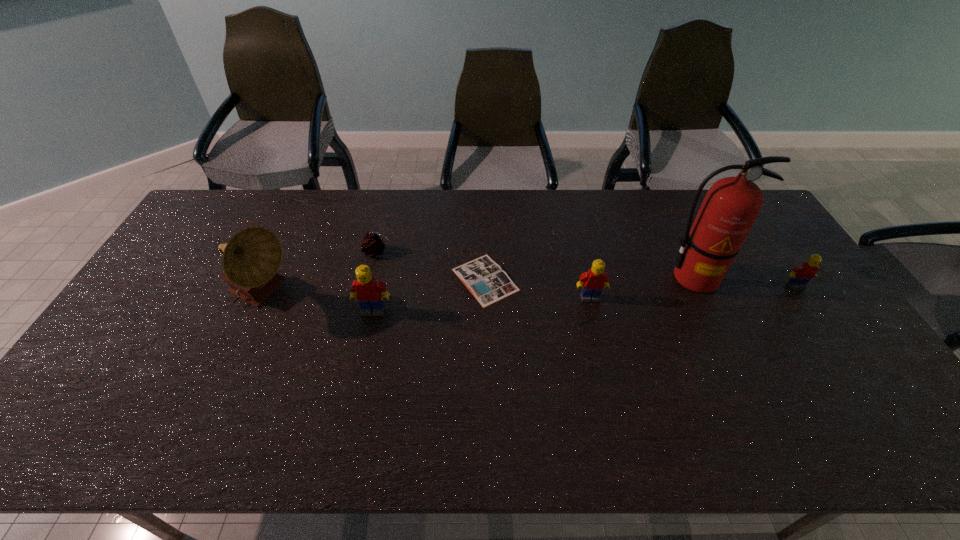
Please point a spot to add another Lego on the left. Please provide its 2D coordinates. Your answer should be formatted as a tuple, i.e. [(x, y)], where the tuple contains the x and y coordinates of a point satisfying the conditions above.

[(145, 324)]